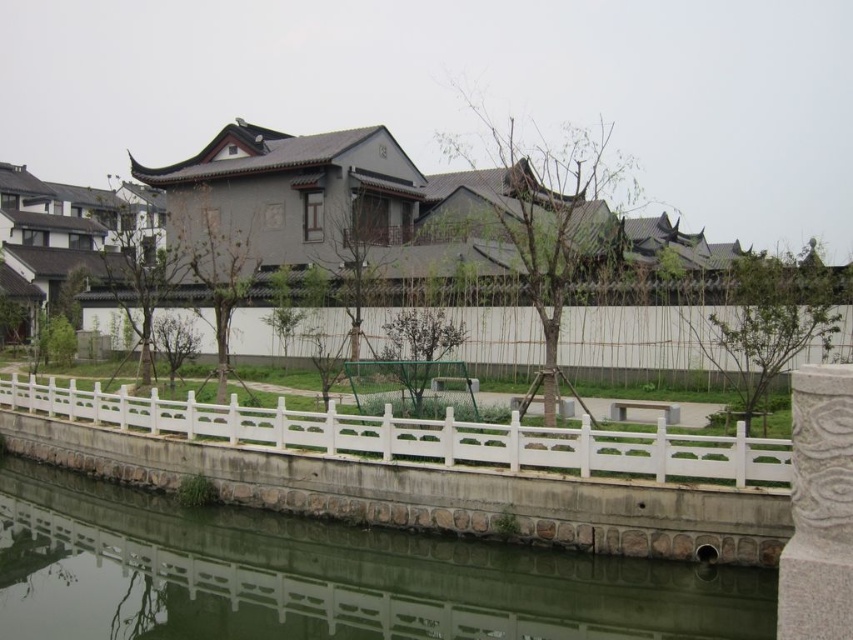
Does smooth concrete river at lower center appear over white plastic fence at lower center?

No, smooth concrete river at lower center is not above white plastic fence at lower center.

Does point (387, 545) come closer to viewer compared to point (788, 477)?

No.

You are a GUI agent. You are given a task and a screenshot of the screen. Output one action in this format:
    pyautogui.click(x=<x>, y=<y>)
    Task: Click on the smooth concrete river at lower center
    This screenshot has width=853, height=640.
    Given the screenshot: What is the action you would take?
    pyautogui.click(x=325, y=577)